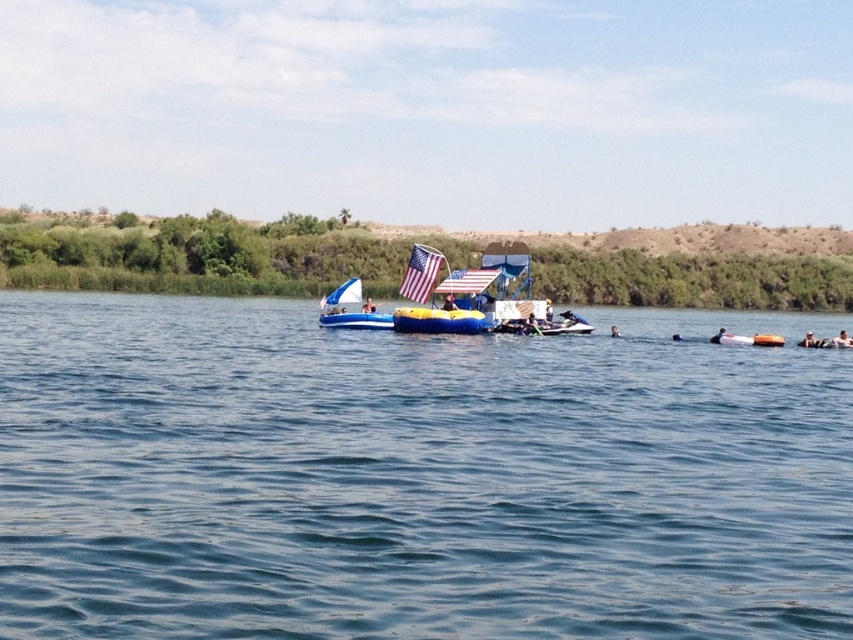
In the scene shown: You are navigating a small boat and need to pass between two points marked on the map. The first point is at coordinates point (341, 296) and the second point is at point (450, 298). According to the scene description, which point is located behind the other?

Point (341, 296) is behind point (450, 298).

Please provide the coordinates of the blue inflatable boat at center in the image. The coordinates should be in the format of a point with two decimal places, such as point (351, 310). The image is divided into a grid with the origin at the bottom left corner. The x and y coordinates range from 0 to 1. The x coordinate increases to the right, and the y coordinate increases upward. You must answer with the exact coordinates provided in the description. If the coordinates are not explicitly stated, respond,

The blue inflatable boat at center is located at point (351, 310).

Consider the image. You are standing on the dock and want to board the white plastic raft at lower right. There is a blue fabric flag at center that is taller than the raft. Can you safely step onto the raft without hitting your head on the flag?

The white plastic raft at lower right is shorter than the blue fabric flag at center, so there is enough clearance to safely step onto the raft without hitting your head on the flag.